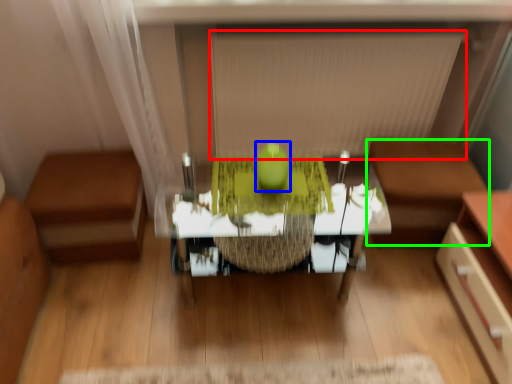
Question: Which is farther away from blind (highlighted by a red box)? apple (highlighted by a blue box) or furniture (highlighted by a green box)?

Choices:
 (A) apple
 (B) furniture

Answer: (A)